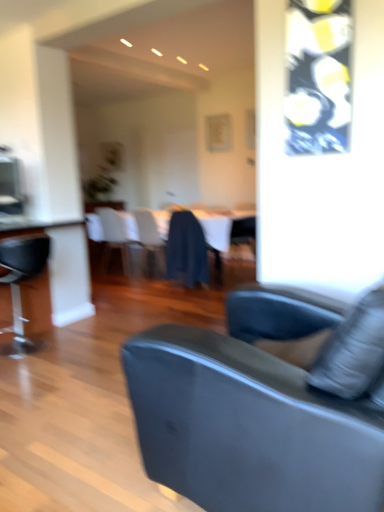
Question: Considering the relative sizes of matte blue chair at center, acting as the 4th chair starting from the front, and suede-like gray couch at center in the image provided, is matte blue chair at center, acting as the 4th chair starting from the front, bigger than suede-like gray couch at center?

Choices:
 (A) no
 (B) yes

Answer: (A)

Question: Does matte blue chair at center, acting as the 4th chair starting from the front, come in front of suede-like gray couch at center?

Choices:
 (A) no
 (B) yes

Answer: (A)

Question: Is matte blue chair at center, acting as the 4th chair starting from the front, smaller than suede-like gray couch at center?

Choices:
 (A) yes
 (B) no

Answer: (A)

Question: From a real-world perspective, is matte blue chair at center, acting as the 4th chair starting from the front, physically below suede-like gray couch at center?

Choices:
 (A) no
 (B) yes

Answer: (A)

Question: Is matte blue chair at center, the 2th chair from the back, positioned beyond the bounds of suede-like gray couch at center?

Choices:
 (A) yes
 (B) no

Answer: (A)

Question: Can you confirm if matte blue chair at center, the 2th chair from the back, is positioned to the right of suede-like gray couch at center?

Choices:
 (A) yes
 (B) no

Answer: (A)

Question: Can dark blue fabric at center, the 2th chair from the front, be found inside black leather chair at left, which appears as the first chair when viewed from the front?

Choices:
 (A) no
 (B) yes

Answer: (A)

Question: Is black leather chair at left, acting as the fifth chair starting from the back, facing away from dark blue fabric at center, the fourth chair when ordered from back to front?

Choices:
 (A) no
 (B) yes

Answer: (A)

Question: Is black leather chair at left, which appears as the first chair when viewed from the front, far away from dark blue fabric at center, the fourth chair when ordered from back to front?

Choices:
 (A) yes
 (B) no

Answer: (A)

Question: Is black leather chair at left, acting as the fifth chair starting from the back, at the left side of dark blue fabric at center, the 2th chair from the front?

Choices:
 (A) no
 (B) yes

Answer: (B)

Question: Is black leather chair at left, acting as the fifth chair starting from the back, positioned behind dark blue fabric at center, the 2th chair from the front?

Choices:
 (A) yes
 (B) no

Answer: (B)

Question: Can you confirm if black leather chair at left, acting as the fifth chair starting from the back, is shorter than dark blue fabric at center, the fourth chair when ordered from back to front?

Choices:
 (A) no
 (B) yes

Answer: (A)

Question: Does white fabric chair at center, the 5th chair in the front-to-back sequence, appear on the right side of white glossy table at center?

Choices:
 (A) yes
 (B) no

Answer: (B)